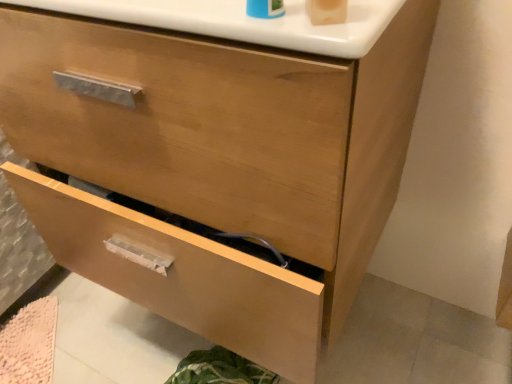
At what (x,y) coordinates should I click in order to perform the action: click on wooden drawer at lower center. Please return your answer as a coordinate pair (x, y). The height and width of the screenshot is (384, 512). Looking at the image, I should click on (182, 276).

Measure the distance between wooden drawer at lower center and camera.

wooden drawer at lower center and camera are 19.94 inches apart.

This screenshot has height=384, width=512. Describe the element at coordinates (182, 276) in the screenshot. I see `wooden drawer at lower center` at that location.

Locate an element on the screen. The width and height of the screenshot is (512, 384). wooden drawer at lower center is located at coordinates (182, 276).